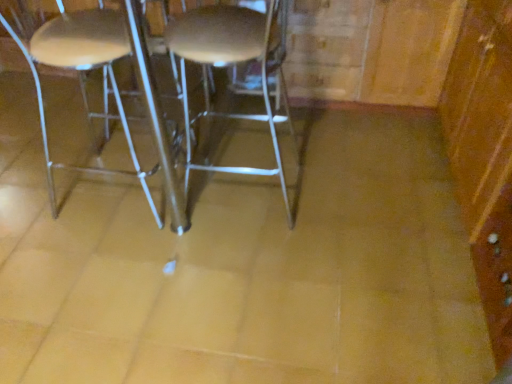
Locate an element on the screen. The height and width of the screenshot is (384, 512). free space in front of metallic silver stool at left is located at coordinates tap(106, 264).